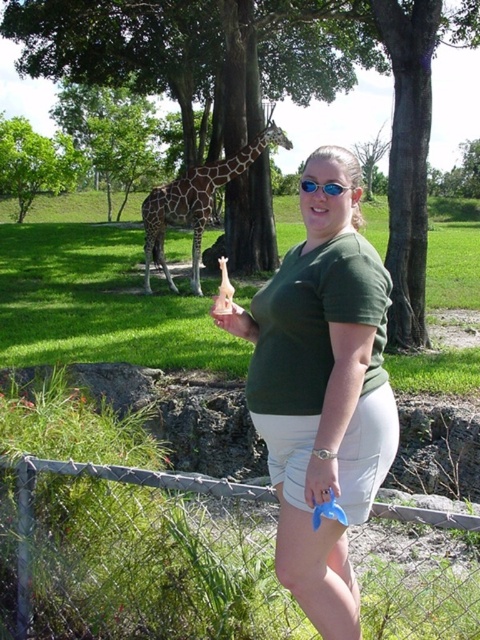
Looking at this image, can you confirm if metal chain-link fence at lower center is bigger than green matte shirt at center?

Correct, metal chain-link fence at lower center is larger in size than green matte shirt at center.

In the scene shown: Who is more distant from viewer, (463, 586) or (286, 545)?

The point (463, 586) is more distant.

Who is more distant from viewer, [417,602] or [348,164]?

The point [417,602] is behind.

Identify the location of metal chain-link fence at lower center. (137, 556).

In the scene shown: Between metal chain-link fence at lower center and pink matte handbag at center, which one has more height?

metal chain-link fence at lower center is taller.

Is metal chain-link fence at lower center to the right of pink matte handbag at center from the viewer's perspective?

Correct, you'll find metal chain-link fence at lower center to the right of pink matte handbag at center.

Where is `metal chain-link fence at lower center`? The image size is (480, 640). metal chain-link fence at lower center is located at coordinates point(137,556).

I want to click on metal chain-link fence at lower center, so click(x=137, y=556).

Consider the image. Between spotted fur giraffe at center and pink matte handbag at center, which one is positioned higher?

Positioned higher is spotted fur giraffe at center.

Is spotted fur giraffe at center positioned at the back of pink matte handbag at center?

Yes, spotted fur giraffe at center is further from the viewer.

Between point (190, 176) and point (245, 323), which one is positioned in front?

Point (245, 323)

Identify the location of spotted fur giraffe at center. (194, 204).